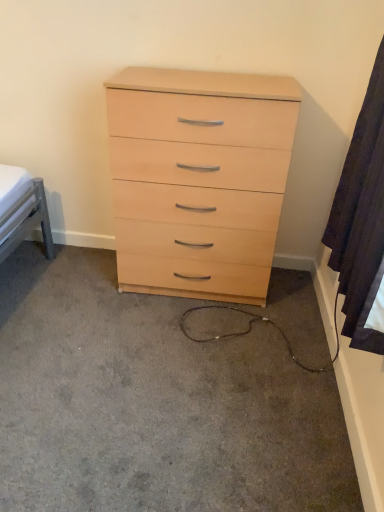
Question: Does light wood dresser at center turn towards dark fabric curtain at right?

Choices:
 (A) yes
 (B) no

Answer: (B)

Question: From a real-world perspective, is light wood dresser at center positioned under dark fabric curtain at right based on gravity?

Choices:
 (A) yes
 (B) no

Answer: (A)

Question: From the image's perspective, is light wood dresser at center located beneath dark fabric curtain at right?

Choices:
 (A) yes
 (B) no

Answer: (A)

Question: Is light wood dresser at center closer to the viewer compared to dark fabric curtain at right?

Choices:
 (A) no
 (B) yes

Answer: (A)

Question: Does light wood dresser at center contain dark fabric curtain at right?

Choices:
 (A) no
 (B) yes

Answer: (A)

Question: Is light wood/veneer chest of drawers at center situated inside dark fabric curtain at right or outside?

Choices:
 (A) outside
 (B) inside

Answer: (A)

Question: Is light wood/veneer chest of drawers at center wider or thinner than dark fabric curtain at right?

Choices:
 (A) thin
 (B) wide

Answer: (B)

Question: Looking at the image, does light wood/veneer chest of drawers at center seem bigger or smaller compared to dark fabric curtain at right?

Choices:
 (A) big
 (B) small

Answer: (A)

Question: Considering the positions of point (124, 233) and point (332, 207), is point (124, 233) closer or farther from the camera than point (332, 207)?

Choices:
 (A) closer
 (B) farther

Answer: (B)

Question: Considering the positions of dark fabric curtain at right and light wood/veneer chest of drawers at center in the image, is dark fabric curtain at right bigger or smaller than light wood/veneer chest of drawers at center?

Choices:
 (A) big
 (B) small

Answer: (B)

Question: Is dark fabric curtain at right to the left or to the right of light wood/veneer chest of drawers at center in the image?

Choices:
 (A) right
 (B) left

Answer: (A)

Question: Is dark fabric curtain at right wider or thinner than light wood/veneer chest of drawers at center?

Choices:
 (A) wide
 (B) thin

Answer: (B)

Question: Does point (345, 162) appear closer or farther from the camera than point (139, 281)?

Choices:
 (A) closer
 (B) farther

Answer: (A)

Question: From a real-world perspective, is dark fabric curtain at right positioned above or below light wood dresser at center?

Choices:
 (A) above
 (B) below

Answer: (A)

Question: From the image's perspective, relative to light wood dresser at center, is dark fabric curtain at right above or below?

Choices:
 (A) below
 (B) above

Answer: (B)